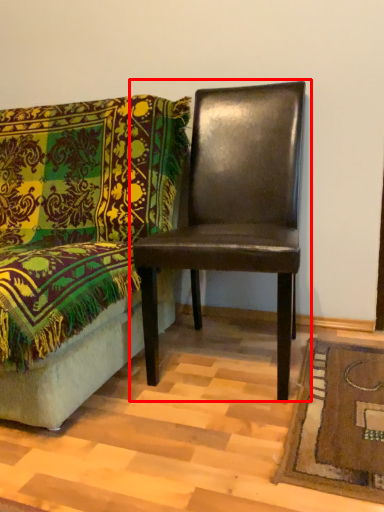
Question: Where is chair (annotated by the red box) located in relation to chair in the image?

Choices:
 (A) left
 (B) right

Answer: (B)